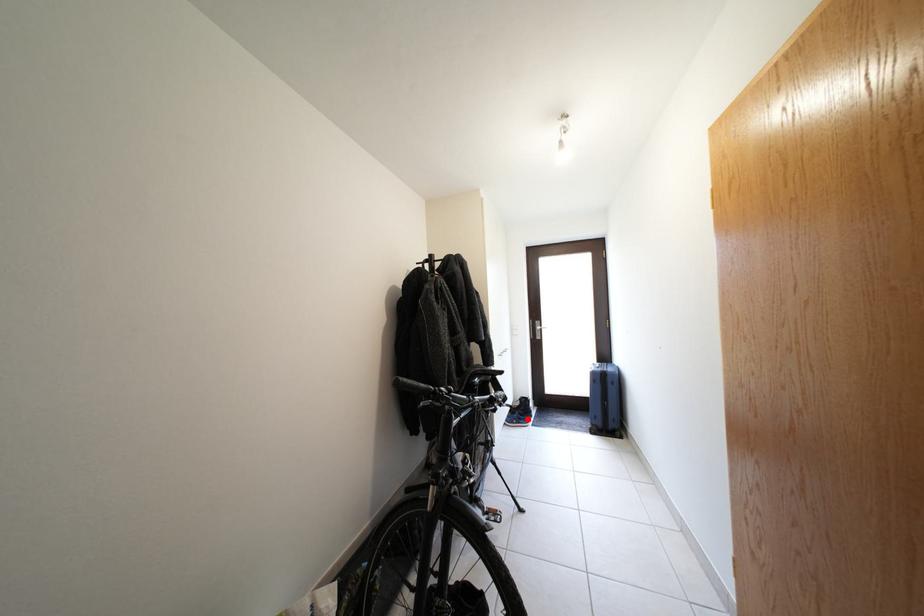
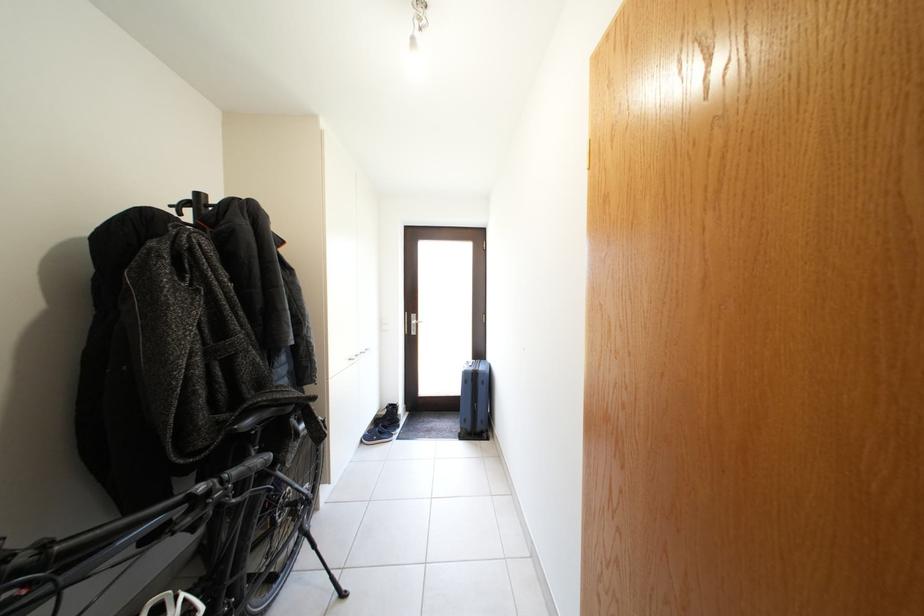
Question: A red point is marked in image1. In image2, is the corresponding 3D point closer to the camera or farther? Reply with the corresponding letter.

Choices:
 (A) The corresponding 3D point is closer.
 (B) The corresponding 3D point is farther.

Answer: (A)